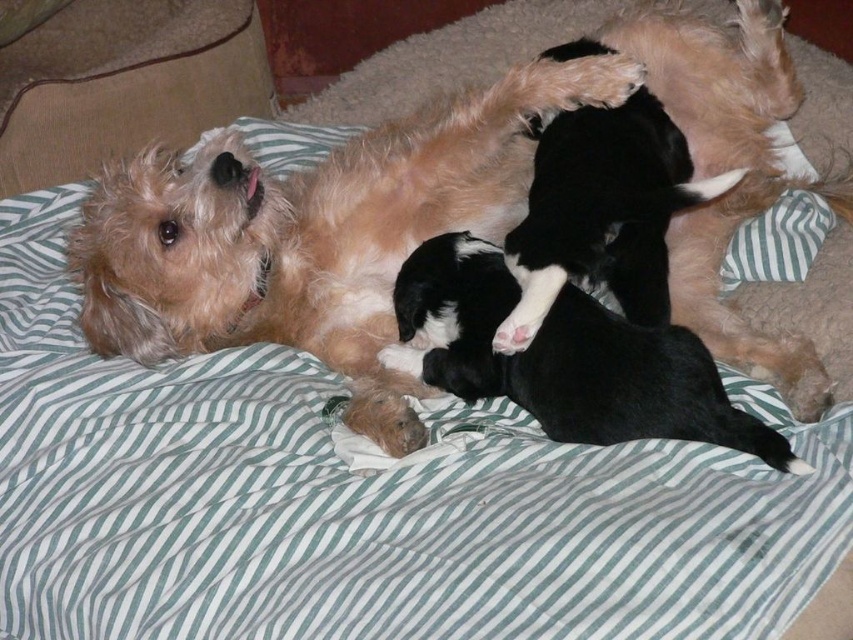
Question: Considering the real-world distances, which object is farthest from the black smooth fur puppies at center?

Choices:
 (A) green striped pillow at center
 (B) fuzzy brown dog at upper left

Answer: (A)

Question: Which object is the farthest from the black smooth fur puppies at center?

Choices:
 (A) fuzzy brown dog at upper left
 (B) green striped pillow at center

Answer: (B)

Question: Does black smooth fur puppies at center appear over black soft fur at center?

Choices:
 (A) no
 (B) yes

Answer: (A)

Question: Does fuzzy brown dog at upper left appear under black smooth fur puppies at center?

Choices:
 (A) no
 (B) yes

Answer: (A)

Question: Which point is farther from the camera taking this photo?

Choices:
 (A) (694, 371)
 (B) (538, 100)

Answer: (B)

Question: From the image, what is the correct spatial relationship of black smooth fur puppies at center in relation to green striped pillow at center?

Choices:
 (A) above
 (B) below

Answer: (B)